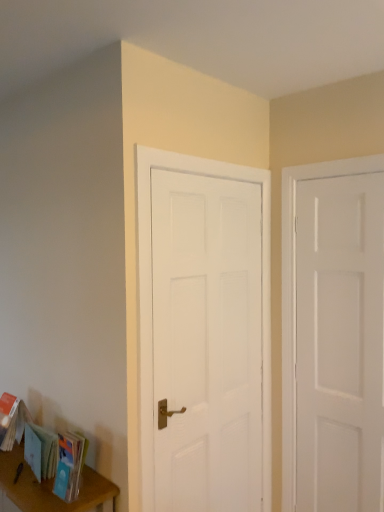
Question: Based on their positions, is white matte door at right, the 2th door in the left-to-right sequence, located to the left or right of matte blue paperback book at lower left?

Choices:
 (A) right
 (B) left

Answer: (A)

Question: From the image's perspective, is white matte door at right, the first door positioned from the right, located above or below matte blue paperback book at lower left?

Choices:
 (A) above
 (B) below

Answer: (A)

Question: Considering the real-world distances, which object is farthest from the light blue paper book at lower left?

Choices:
 (A) wooden table at lower left
 (B) white matte door at center, which appears as the first door when viewed from the left
 (C) matte blue paperback book at lower left
 (D) white matte door at right, the first door positioned from the right

Answer: (D)

Question: Based on their relative distances, which object is farther from the matte blue paperback book at lower left?

Choices:
 (A) white matte door at right, the first door positioned from the right
 (B) white matte door at center, which appears as the first door when viewed from the left
 (C) light blue paper book at lower left
 (D) wooden table at lower left

Answer: (A)